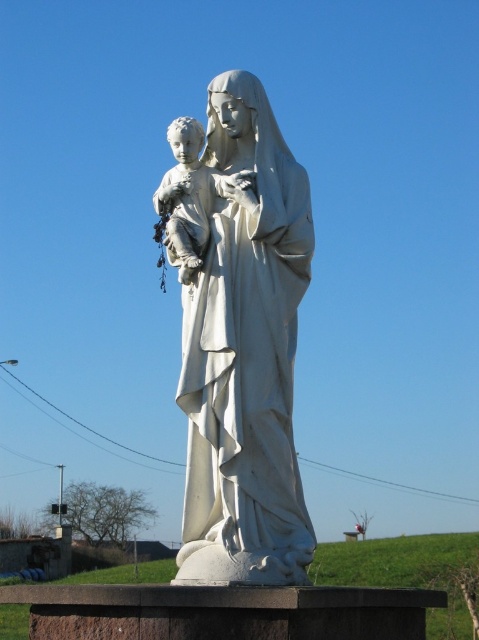
You are standing in front of the statue of a woman holding a child. There is a point at coordinates point (289, 227). Can you determine if this point is closer to you than 60 meters?

The distance of point (289, 227) from camera is 56.52 meters, so yes, the point is closer than 60 meters.

You are standing in a park and see the white marble statue at center. If you face the statue and walk straight ahead, which direction will you be facing relative to the statue?

Since the statue is at the center point coordinates of approximately 0.527 on the x and 0.499 on the y axis, facing the statue and walking straight ahead would mean you are facing away from the statue, moving towards the opposite direction of its location in the park.